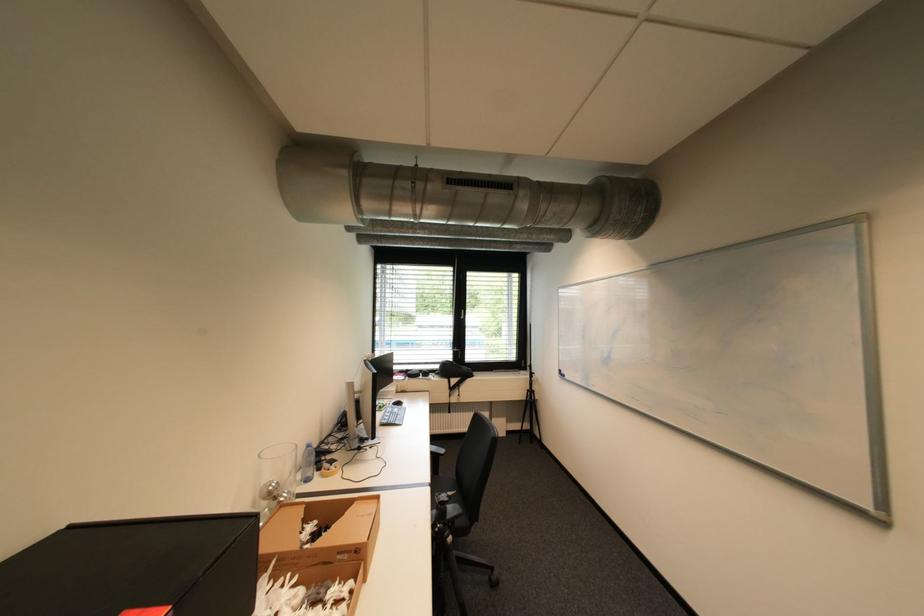
Describe the element at coordinates (307, 455) in the screenshot. I see `a bottle cap` at that location.